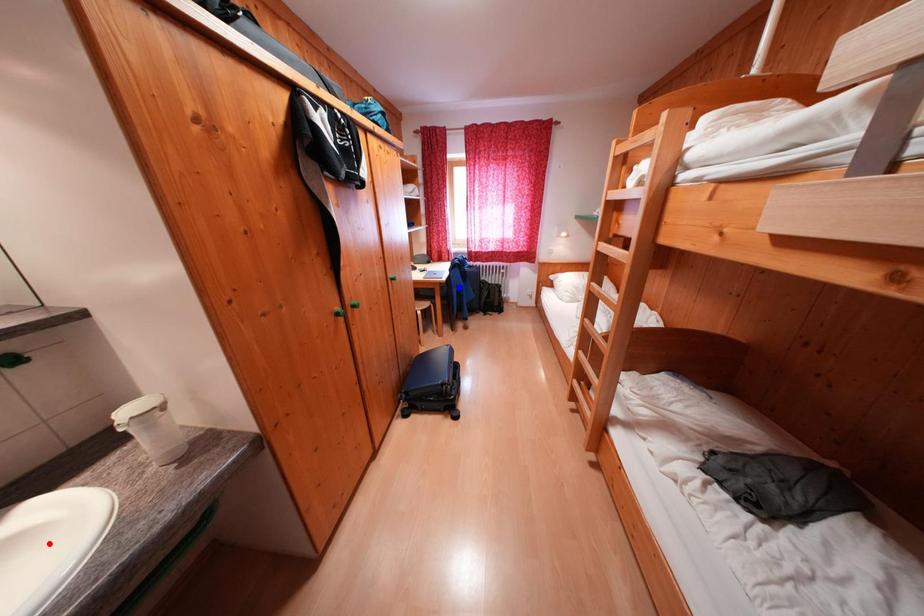
Question: Two points are marked on the image. Which point is closer to the camera?

Choices:
 (A) Blue point is closer.
 (B) Red point is closer.

Answer: (B)